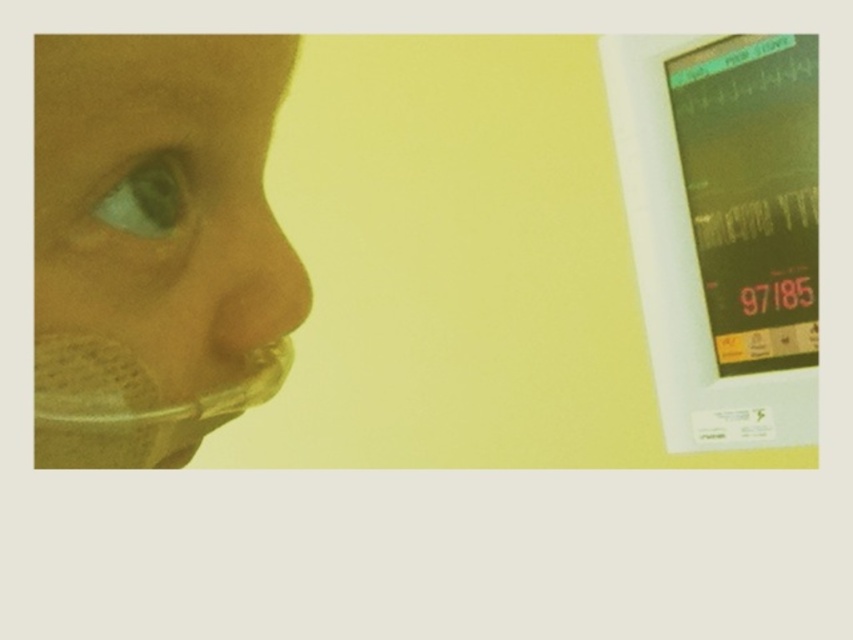
Looking at this image, does translucent plastic mask at left have a larger size compared to green matte eye at center?

Correct, translucent plastic mask at left is larger in size than green matte eye at center.

Between translucent plastic mask at left and green matte eye at center, which one is positioned lower?

translucent plastic mask at left is below.

Does point (91, 124) lie in front of point (142, 218)?

Yes, it is in front of point (142, 218).

The width and height of the screenshot is (853, 640). What are the coordinates of `translucent plastic mask at left` in the screenshot? It's located at (155, 243).

Is matte green monitor at right behind translucent plastic nose at center?

That is True.

Who is more distant from viewer, [805,77] or [264,268]?

The point [805,77] is behind.

The width and height of the screenshot is (853, 640). Find the location of `matte green monitor at right`. matte green monitor at right is located at coordinates (752, 193).

Does translucent plastic mask at left appear over matte green monitor at right?

No.

Between point (148, 301) and point (730, 70), which one is positioned in front?

Positioned in front is point (148, 301).

In the scene shown: Who is more forward, (178,147) or (788,36)?

Point (178,147)

Identify the location of translucent plastic mask at left. (155, 243).